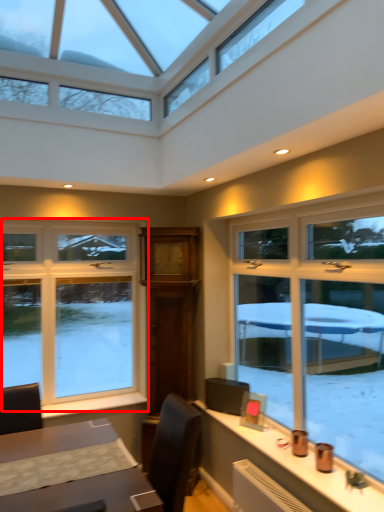
Question: Considering the relative positions of window (annotated by the red box) and window sill in the image provided, where is window (annotated by the red box) located with respect to the staircase?

Choices:
 (A) left
 (B) right

Answer: (A)